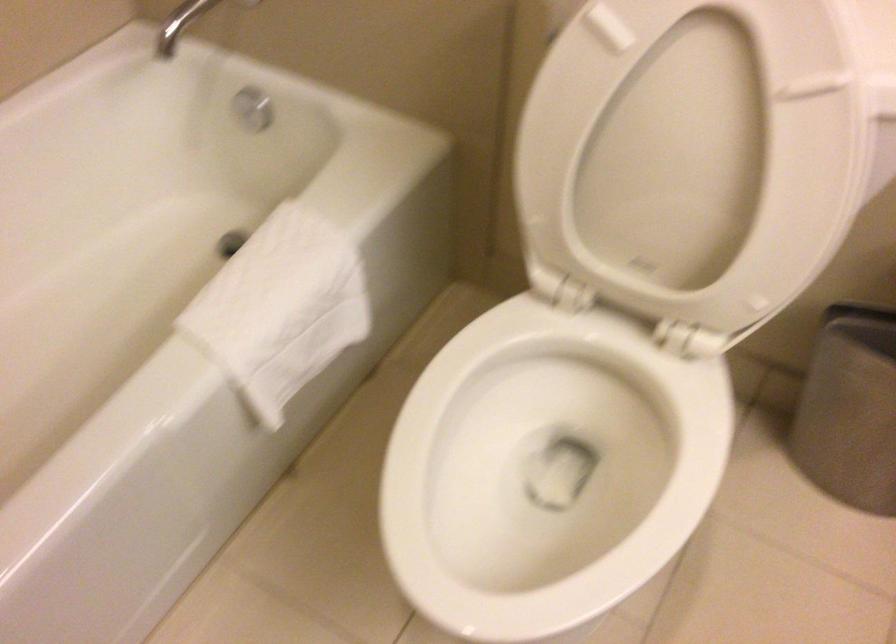
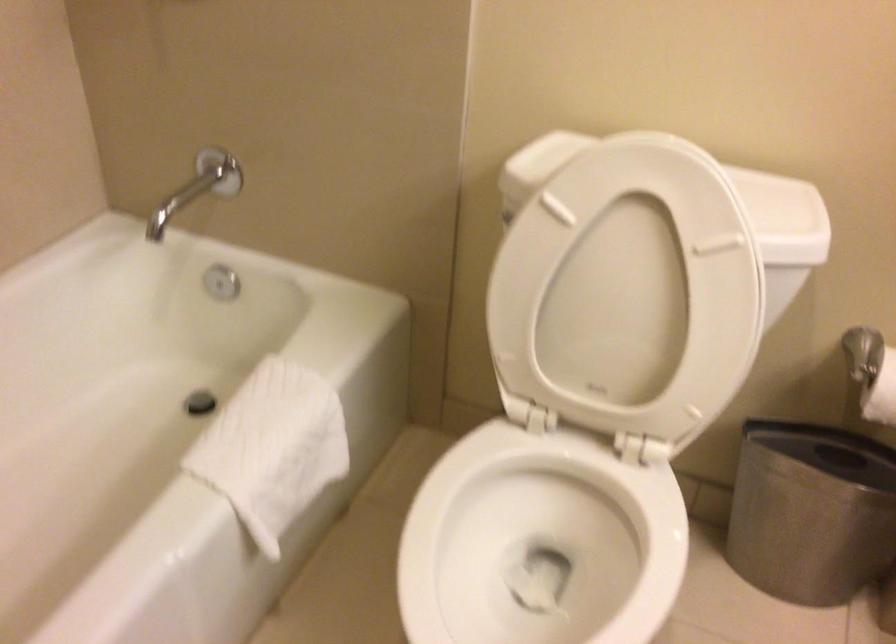
The point at (698, 138) is marked in the first image. Where is the corresponding point in the second image?

(633, 285)